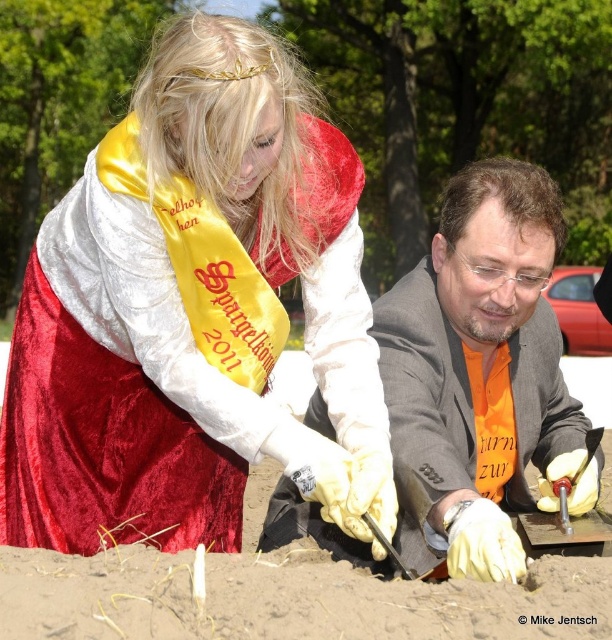
Question: Which of these objects is positioned closest to the brown sandy soil at lower center?

Choices:
 (A) orange fabric suit at center
 (B) velvet red dress at center

Answer: (B)

Question: Which point is farther to the camera?

Choices:
 (A) velvet red dress at center
 (B) orange fabric suit at center

Answer: (B)

Question: Considering the relative positions of orange fabric suit at center and brown sandy soil at lower center in the image provided, where is orange fabric suit at center located with respect to brown sandy soil at lower center?

Choices:
 (A) left
 (B) right

Answer: (B)

Question: Which of these objects is positioned closest to the brown sandy soil at lower center?

Choices:
 (A) orange fabric suit at center
 (B) velvet red dress at center

Answer: (B)

Question: Is velvet red dress at center wider than orange fabric suit at center?

Choices:
 (A) yes
 (B) no

Answer: (B)

Question: Does velvet red dress at center have a lesser width compared to brown sandy soil at lower center?

Choices:
 (A) no
 (B) yes

Answer: (B)